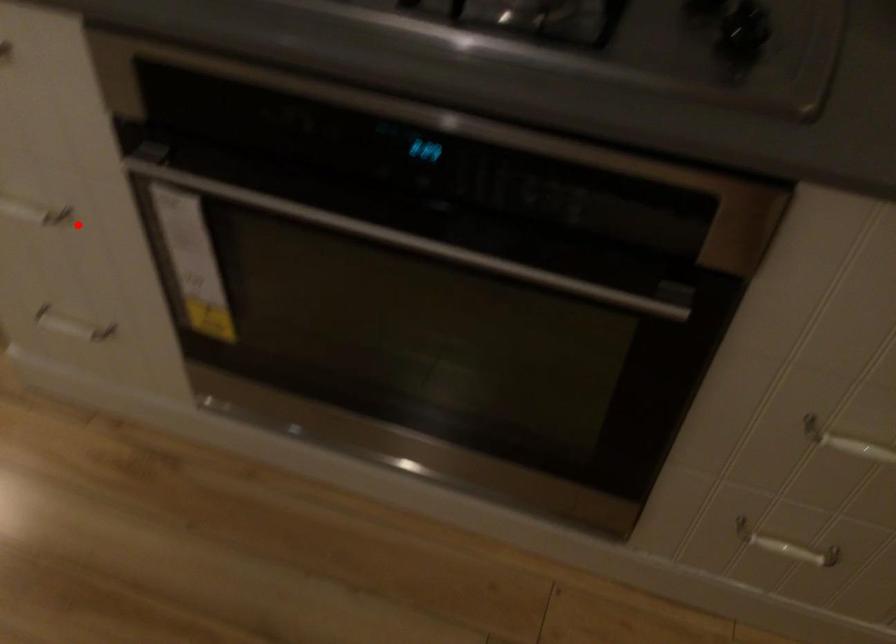
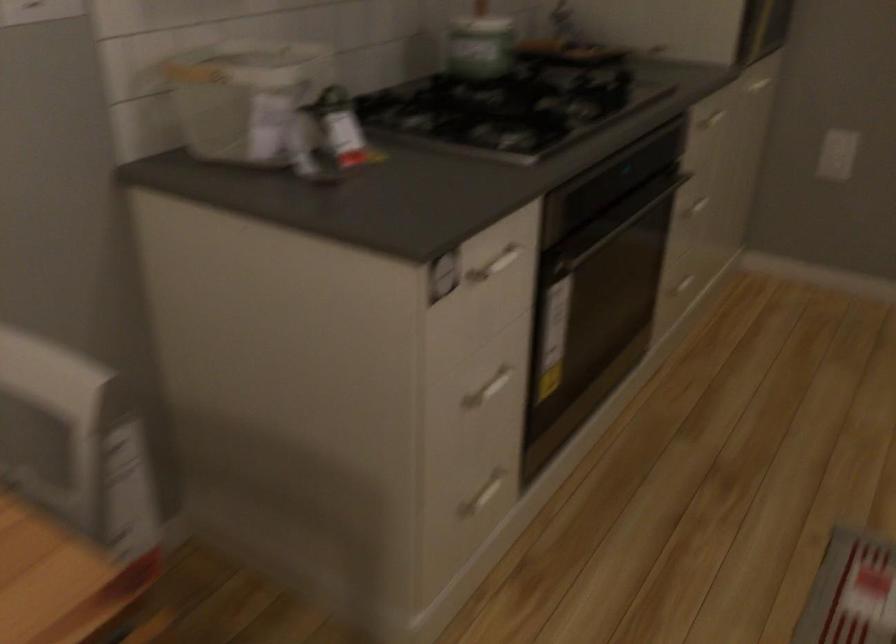
In the second image, find the point that corresponds to the highlighted location in the first image.

(487, 389)